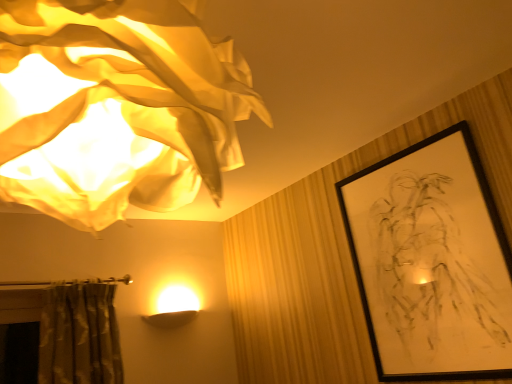
What do you see at coordinates (431, 261) in the screenshot? I see `black matte picture frame at upper right` at bounding box center [431, 261].

What is the approximate height of black matte picture frame at upper right?

The height of black matte picture frame at upper right is 99.81 centimeters.

In order to face black matte picture frame at upper right, should I rotate leftwards or rightwards?

It's best to rotate right around 20.946 degrees.

The height and width of the screenshot is (384, 512). What are the coordinates of `black matte picture frame at upper right` in the screenshot? It's located at (431, 261).

Measure the distance between point (47, 95) and camera.

A distance of 68.30 centimeters exists between point (47, 95) and camera.

What do you see at coordinates (116, 107) in the screenshot?
I see `matte white fabric lampshade at upper left` at bounding box center [116, 107].

Locate an element on the screen. The width and height of the screenshot is (512, 384). matte white fabric lampshade at upper left is located at coordinates (116, 107).

What are the coordinates of `black matte picture frame at upper right` in the screenshot? It's located at (431, 261).

Is black matte picture frame at upper right to the left of matte white fabric lampshade at upper left from the viewer's perspective?

No.

Which object is further away from the camera, black matte picture frame at upper right or matte white fabric lampshade at upper left?

black matte picture frame at upper right.

Between point (418, 304) and point (91, 165), which one is positioned behind?

The point (418, 304) is farther from the camera.

From the image's perspective, which object appears higher, black matte picture frame at upper right or matte white fabric lampshade at upper left?

matte white fabric lampshade at upper left.

From a real-world perspective, is black matte picture frame at upper right above or below matte white fabric lampshade at upper left?

black matte picture frame at upper right is below matte white fabric lampshade at upper left.

Which of these two, black matte picture frame at upper right or matte white fabric lampshade at upper left, is wider?

Wider between the two is matte white fabric lampshade at upper left.

Who is shorter, black matte picture frame at upper right or matte white fabric lampshade at upper left?

With less height is matte white fabric lampshade at upper left.

Based on their sizes in the image, would you say black matte picture frame at upper right is bigger or smaller than matte white fabric lampshade at upper left?

In the image, black matte picture frame at upper right appears to be smaller than matte white fabric lampshade at upper left.

Looking at this image, is black matte picture frame at upper right outside of matte white fabric lampshade at upper left?

That's correct, black matte picture frame at upper right is outside of matte white fabric lampshade at upper left.

Is black matte picture frame at upper right placed right next to matte white fabric lampshade at upper left?

black matte picture frame at upper right and matte white fabric lampshade at upper left are clearly separated.

Is black matte picture frame at upper right aimed at matte white fabric lampshade at upper left?

Yes.

What's the angular difference between black matte picture frame at upper right and matte white fabric lampshade at upper left's facing directions?

There is a 0.0354-degree angle between the facing directions of black matte picture frame at upper right and matte white fabric lampshade at upper left.

Find the location of `lamp on the left of black matte picture frame at upper right`. lamp on the left of black matte picture frame at upper right is located at coordinates (116, 107).

Is matte white fabric lampshade at upper left to the left of black matte picture frame at upper right from the viewer's perspective?

Correct, you'll find matte white fabric lampshade at upper left to the left of black matte picture frame at upper right.

In the scene shown: Is the position of matte white fabric lampshade at upper left more distant than that of black matte picture frame at upper right?

No, matte white fabric lampshade at upper left is closer to the camera.

Is point (24, 102) less distant than point (358, 199)?

Yes, point (24, 102) is closer to viewer.

From the image's perspective, is matte white fabric lampshade at upper left on top of black matte picture frame at upper right?

Yes, from the image's perspective, matte white fabric lampshade at upper left is over black matte picture frame at upper right.

From a real-world perspective, is matte white fabric lampshade at upper left below black matte picture frame at upper right?

No.

Which object is wider, matte white fabric lampshade at upper left or black matte picture frame at upper right?

matte white fabric lampshade at upper left is wider.

Between matte white fabric lampshade at upper left and black matte picture frame at upper right, which one has more height?

Standing taller between the two is black matte picture frame at upper right.

Between matte white fabric lampshade at upper left and black matte picture frame at upper right, which one has larger size?

matte white fabric lampshade at upper left.

Would you say matte white fabric lampshade at upper left is inside or outside black matte picture frame at upper right?

matte white fabric lampshade at upper left is not enclosed by black matte picture frame at upper right.

Based on the photo, are matte white fabric lampshade at upper left and black matte picture frame at upper right making contact?

No, matte white fabric lampshade at upper left is not in contact with black matte picture frame at upper right.

Is matte white fabric lampshade at upper left looking in the opposite direction of black matte picture frame at upper right?

No, matte white fabric lampshade at upper left is not facing away from black matte picture frame at upper right.

Can you tell me how much matte white fabric lampshade at upper left and black matte picture frame at upper right differ in facing direction?

The facing directions of matte white fabric lampshade at upper left and black matte picture frame at upper right are 0.0354 degrees apart.

Find the location of `picture frame lying below the matte white fabric lampshade at upper left (from the image's perspective)`. picture frame lying below the matte white fabric lampshade at upper left (from the image's perspective) is located at coordinates (431, 261).

This screenshot has height=384, width=512. Find the location of `picture frame on the right of matte white fabric lampshade at upper left`. picture frame on the right of matte white fabric lampshade at upper left is located at coordinates (431, 261).

You are a GUI agent. You are given a task and a screenshot of the screen. Output one action in this format:
    pyautogui.click(x=<x>, y=<y>)
    Task: Click on the lamp that appears in front of the black matte picture frame at upper right
    This screenshot has height=384, width=512.
    Given the screenshot: What is the action you would take?
    pyautogui.click(x=116, y=107)